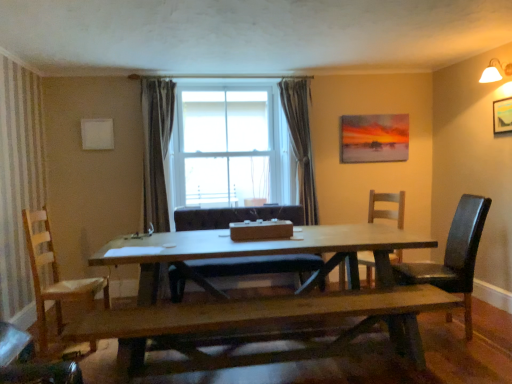
Locate an element on the screen. This screenshot has width=512, height=384. vacant area on top of matte acrylic painting at upper right, which appears as the 2th picture frame when viewed from the right (from a real-world perspective) is located at coordinates (378, 115).